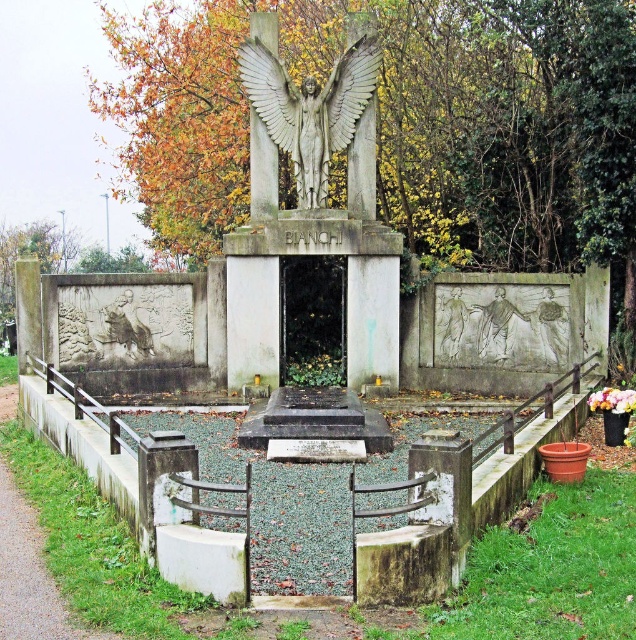
Between polished stone angel at center and bronze statue of an angel at center, which one appears on the left side from the viewer's perspective?

From the viewer's perspective, bronze statue of an angel at center appears more on the left side.

Does polished stone angel at center have a lesser width compared to bronze statue of an angel at center?

Incorrect, polished stone angel at center's width is not less than bronze statue of an angel at center's.

Which is behind, point (249, 88) or point (338, 81)?

The point (249, 88) is more distant.

What are the coordinates of `polished stone angel at center` in the screenshot? It's located at (310, 212).